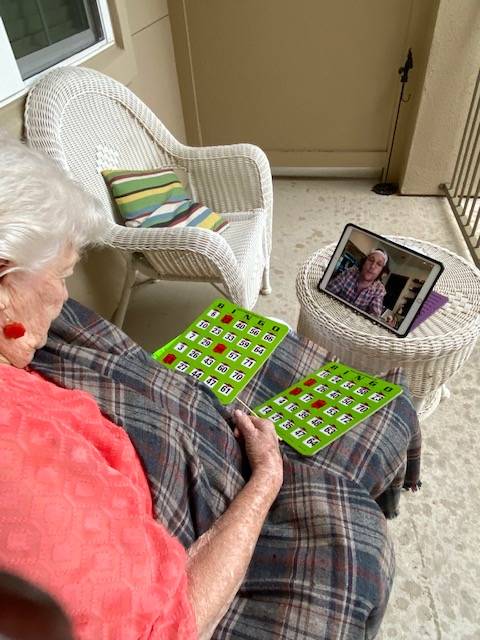
Find the location of `place to sit`. place to sit is located at coordinates pyautogui.click(x=227, y=185).